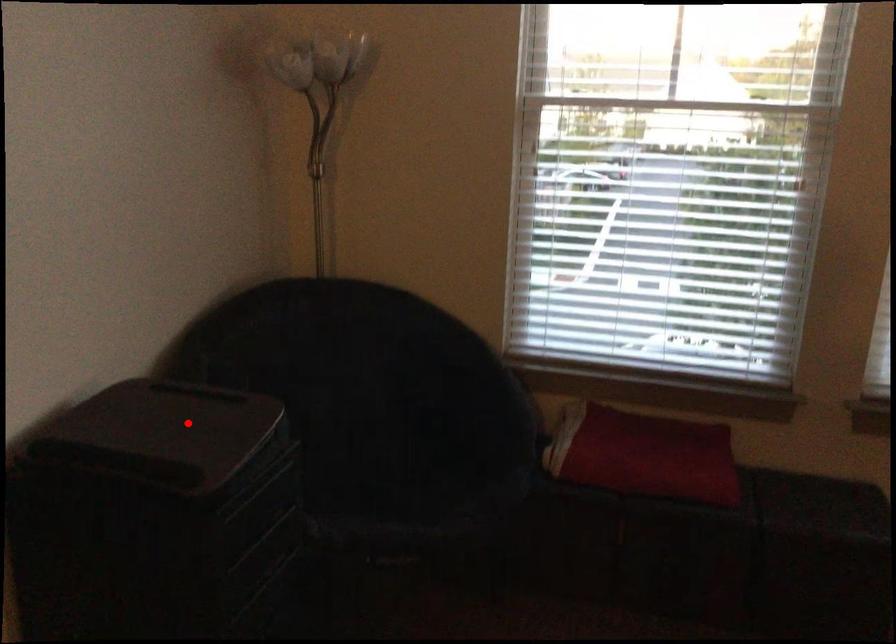
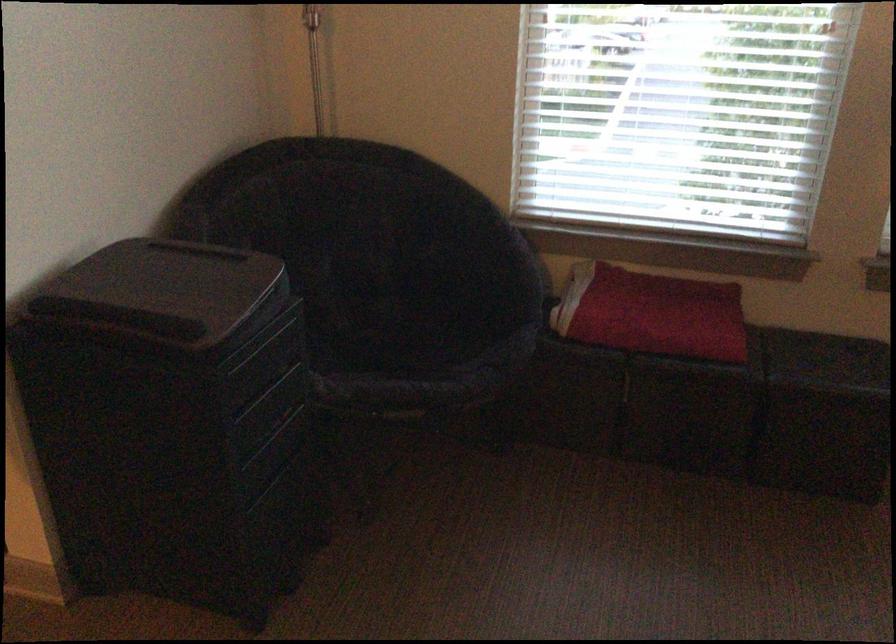
Find the pixel in the second image that matches the highlighted location in the first image.

(188, 281)